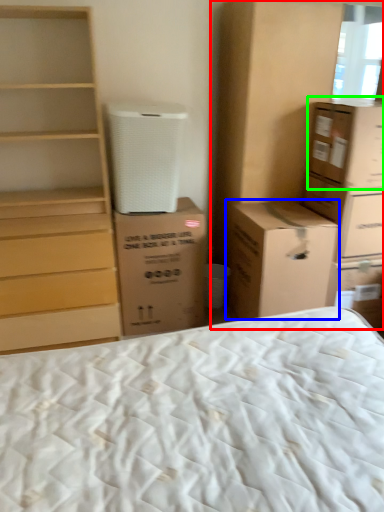
Question: Considering the real-world distances, which object is closest to cabinetry (highlighted by a red box)? cardboard box (highlighted by a blue box) or cardboard box (highlighted by a green box).

Choices:
 (A) cardboard box
 (B) cardboard box

Answer: (B)